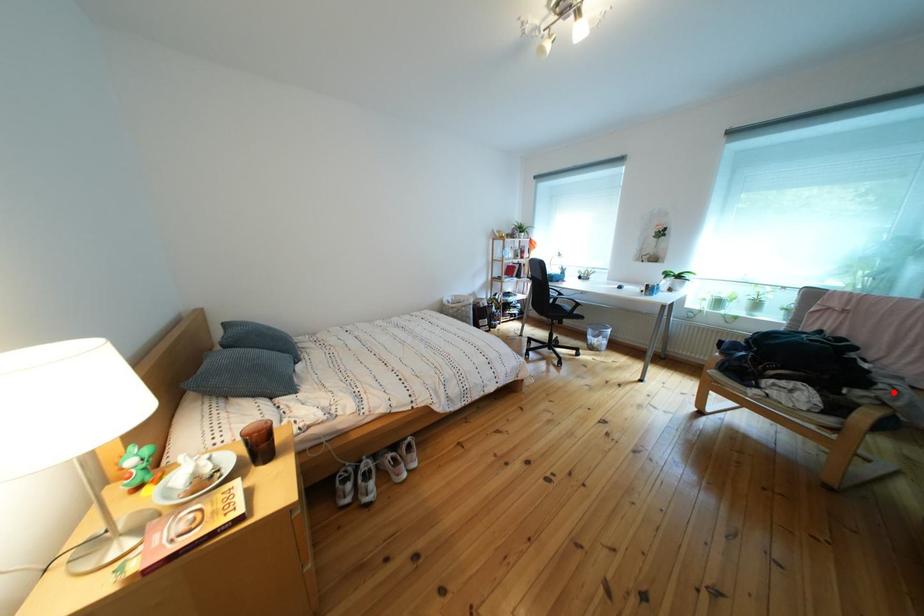
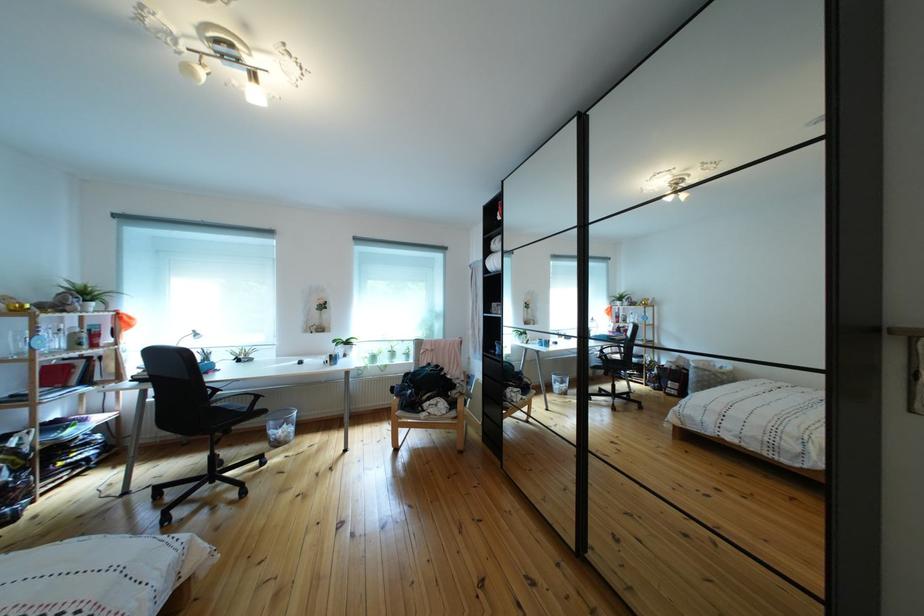
Where in the second image is the point corresponding to the highlighted location from the first image?

(469, 391)